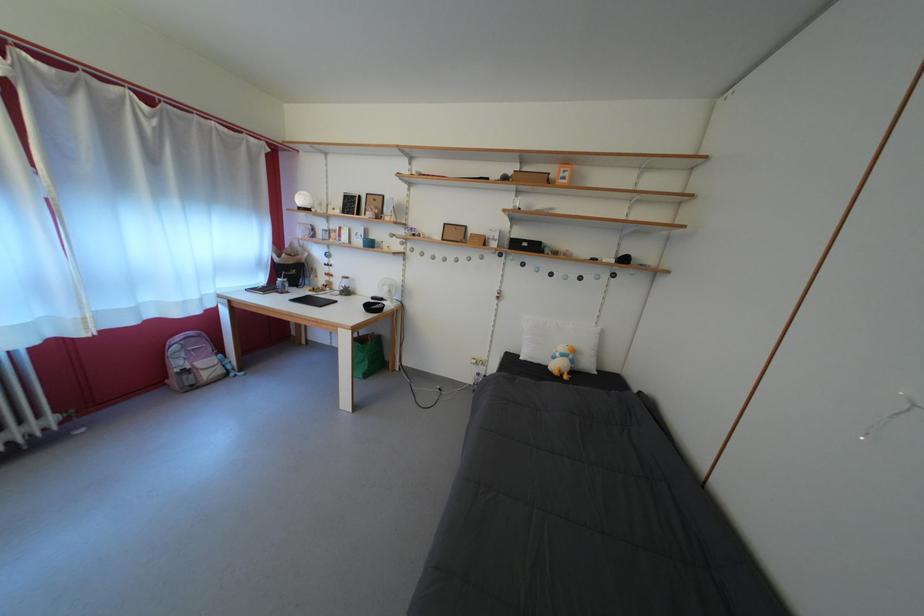
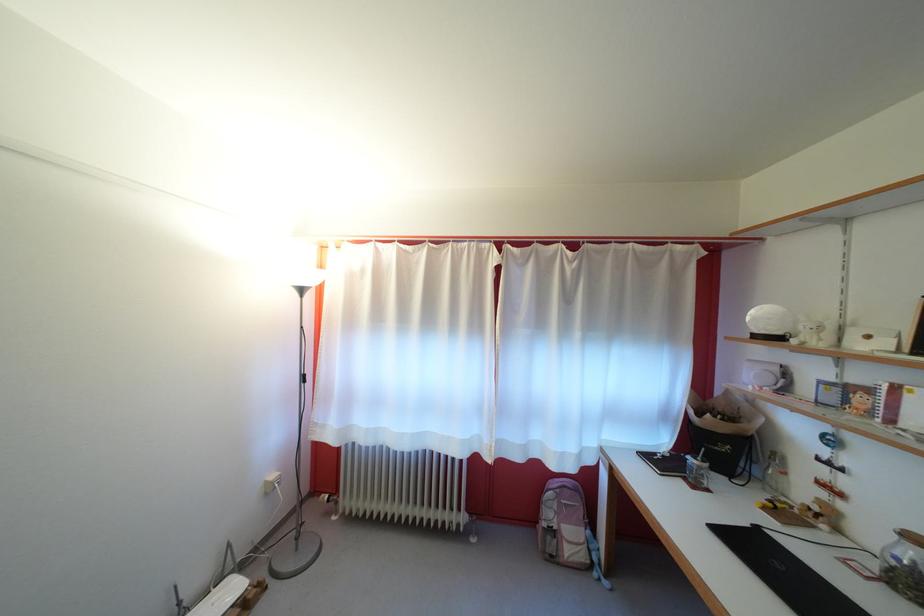
The point at (292,288) is marked in the first image. Where is the corresponding point in the second image?

(708, 474)